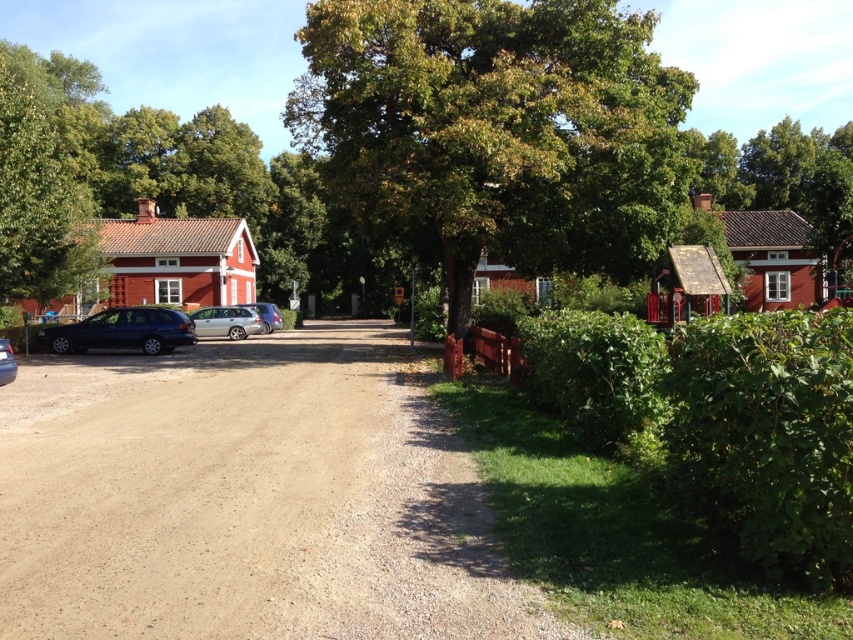
Question: Is green leafy tree at center thinner than satin black station wagon at lower left?

Choices:
 (A) yes
 (B) no

Answer: (B)

Question: Which of the following is the closest to the observer?

Choices:
 (A) satin black station wagon at lower left
 (B) matte black car at left
 (C) green leafy hedge at lower right
 (D) green leafy tree at center

Answer: (C)

Question: Can you confirm if green leafy tree at upper left is thinner than satin black station wagon at lower left?

Choices:
 (A) no
 (B) yes

Answer: (A)

Question: Estimate the real-world distances between objects in this image. Which object is closer to the matte black car at left?

Choices:
 (A) green leafy tree at center
 (B) green leafy hedge at lower right
 (C) green leafy hedge at right
 (D) green leafy tree at upper left

Answer: (B)

Question: Does green leafy tree at center have a larger size compared to matte black car at left?

Choices:
 (A) no
 (B) yes

Answer: (B)

Question: Which point is farther from the camera taking this photo?

Choices:
 (A) (7, 292)
 (B) (10, 365)

Answer: (A)